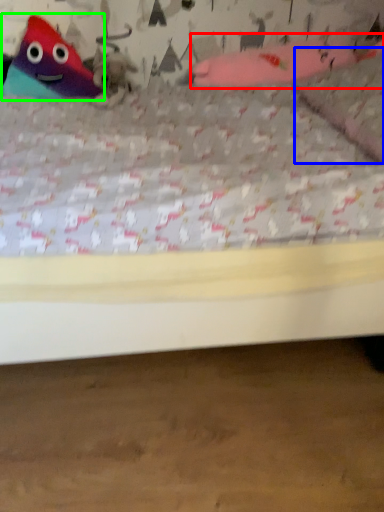
Question: Considering the real-world distances, which object is closest to toy (highlighted by a red box)? pillow (highlighted by a blue box) or toy (highlighted by a green box).

Choices:
 (A) pillow
 (B) toy

Answer: (A)